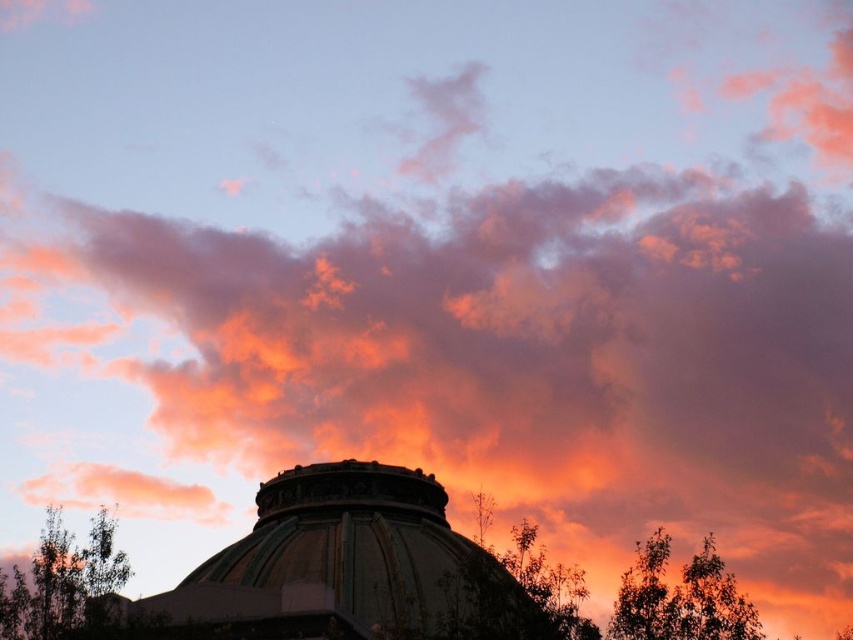
Question: Which object appears farthest from the camera in this image?

Choices:
 (A) green leafy tree at right
 (B) green leafy tree at lower left
 (C) metallic dome at center

Answer: (A)

Question: Does metallic dome at center appear on the right side of green leafy tree at right?

Choices:
 (A) no
 (B) yes

Answer: (A)

Question: Can you confirm if green leafy tree at lower left is positioned above green leafy tree at right?

Choices:
 (A) yes
 (B) no

Answer: (A)

Question: Which object is farther from the camera taking this photo?

Choices:
 (A) green leafy tree at right
 (B) green leafy tree at lower left

Answer: (A)

Question: Is green leafy tree at lower left above green leafy tree at right?

Choices:
 (A) no
 (B) yes

Answer: (B)

Question: Which of the following is the farthest from the observer?

Choices:
 (A) (126, 576)
 (B) (418, 534)

Answer: (B)